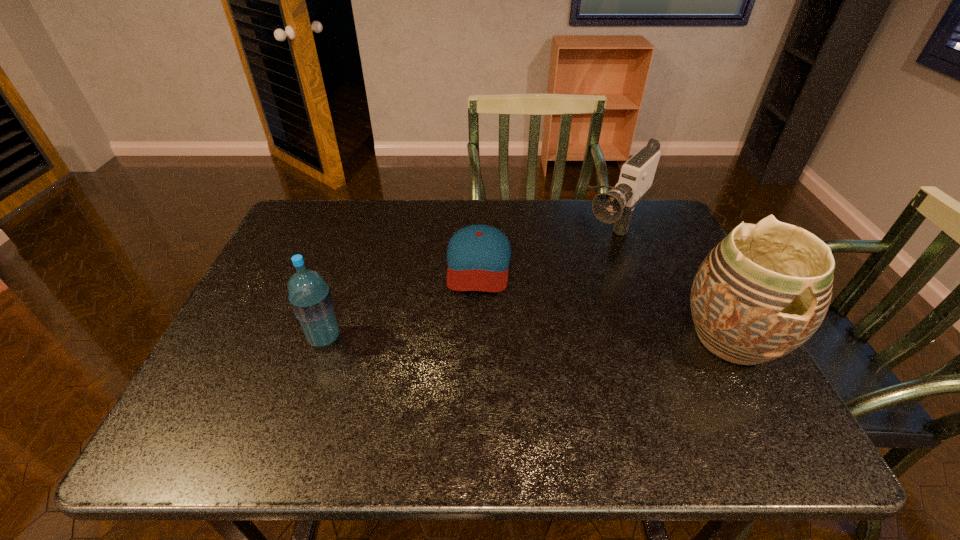
Identify the location of water bottle. (310, 297).

Where is `pottery`? The image size is (960, 540). pottery is located at coordinates (764, 290).

Locate an element on the screen. The height and width of the screenshot is (540, 960). camcorder is located at coordinates (616, 206).

You are a GUI agent. You are given a task and a screenshot of the screen. Output one action in this format:
    pyautogui.click(x=<x>, y=<y>)
    Task: Click on the shortest object
    
    Given the screenshot: What is the action you would take?
    pyautogui.click(x=478, y=256)

The image size is (960, 540). I want to click on the third object from right to left, so [478, 256].

Locate an element on the screen. This screenshot has height=540, width=960. free space located 0.320m on the back of the water bottle is located at coordinates (357, 242).

In order to click on vacant space located on the back of the pottery in this screenshot , I will do click(671, 229).

You are a GUI agent. You are given a task and a screenshot of the screen. Output one action in this format:
    pyautogui.click(x=<x>, y=<y>)
    Task: Click on the vacant area located 0.390m on the recording direction of the camcorder
    The image size is (960, 540).
    Given the screenshot: What is the action you would take?
    pyautogui.click(x=522, y=338)

Where is `vacant space located 0.400m on the recording direction of the camcorder`? The image size is (960, 540). vacant space located 0.400m on the recording direction of the camcorder is located at coordinates (520, 341).

You are a GUI agent. You are given a task and a screenshot of the screen. Output one action in this format:
    pyautogui.click(x=<x>, y=<y>)
    Task: Click on the free space located on the recording direction of the camcorder
    This screenshot has width=960, height=540.
    Given the screenshot: What is the action you would take?
    pyautogui.click(x=556, y=302)